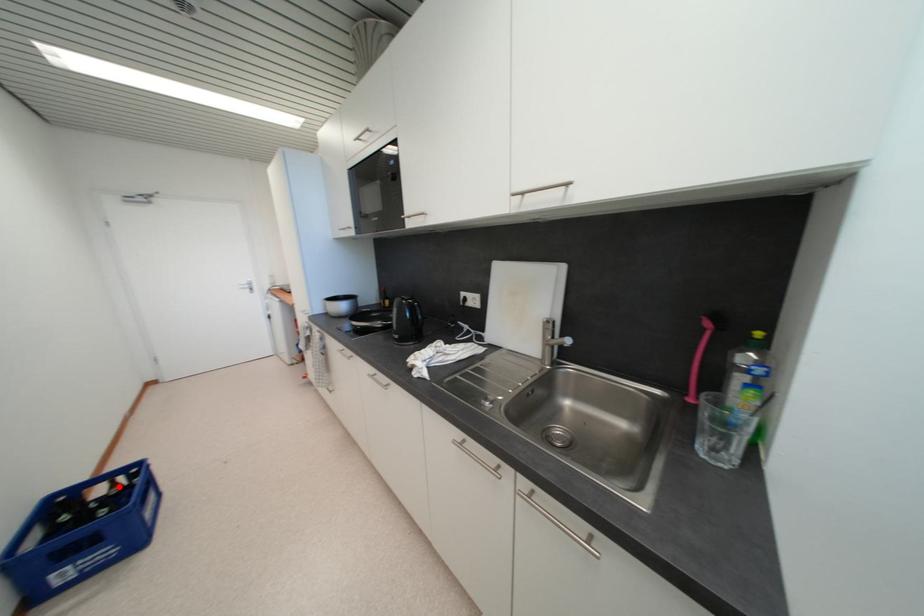
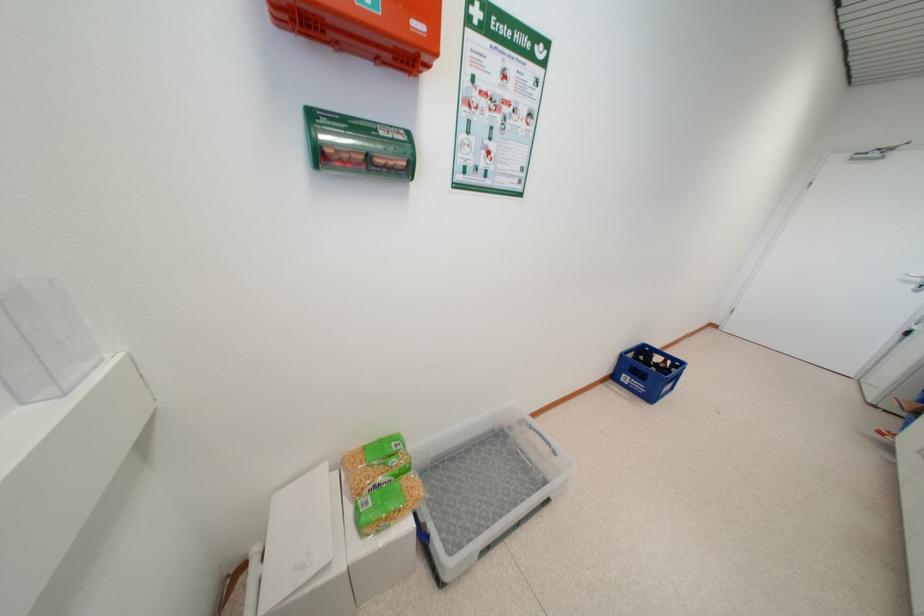
Question: A red point is marked in image1. In image2, is the corresponding 3D point closer to the camera or farther? Reply with the corresponding letter.

Choices:
 (A) The corresponding 3D point is closer.
 (B) The corresponding 3D point is farther.

Answer: (B)